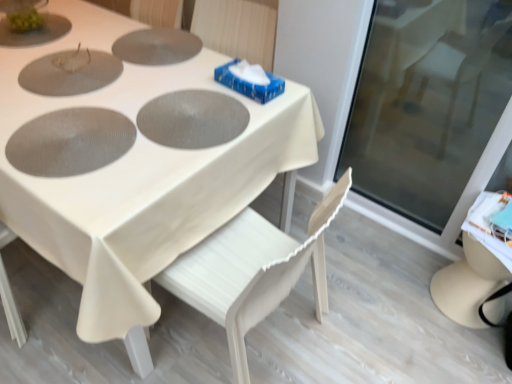
Locate an element on the screen. The width and height of the screenshot is (512, 384). vacant area that is situated to the right of matte gray pizza pan at center, which appears as the third pizza pan when viewed from the back is located at coordinates (151, 163).